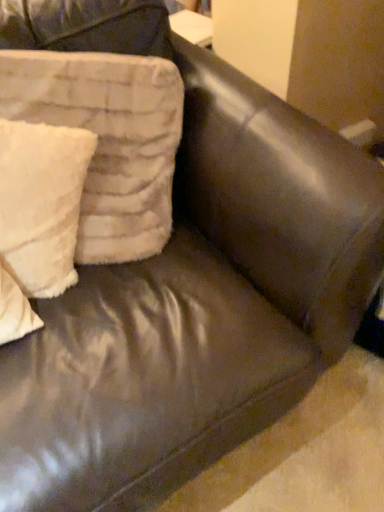
In order to face white fuzzy pillow at left, marked as the first pillow in a right-to-left arrangement, should I rotate leftwards or rightwards?

You should look left and rotate roughly 14.630 degrees.

In order to click on white fuzzy pillow at left, which is the 2th pillow from left to right in this screenshot , I will do `click(108, 140)`.

The image size is (384, 512). What do you see at coordinates (108, 140) in the screenshot?
I see `white fuzzy pillow at left, which is the 2th pillow from left to right` at bounding box center [108, 140].

Locate an element on the screen. Image resolution: width=384 pixels, height=512 pixels. white fluffy pillow at left, placed as the 1th pillow when sorted from left to right is located at coordinates (41, 203).

What do you see at coordinates (41, 203) in the screenshot?
I see `white fluffy pillow at left, placed as the 1th pillow when sorted from left to right` at bounding box center [41, 203].

Identify the location of white fuzzy pillow at left, marked as the first pillow in a right-to-left arrangement. (108, 140).

Would you say white fuzzy pillow at left, which is the 2th pillow from left to right, is to the left or to the right of white fluffy pillow at left, placed as the 1th pillow when sorted from left to right, in the picture?

From the image, it's evident that white fuzzy pillow at left, which is the 2th pillow from left to right, is to the right of white fluffy pillow at left, placed as the 1th pillow when sorted from left to right.

In the image, is white fuzzy pillow at left, which is the 2th pillow from left to right, positioned in front of or behind white fluffy pillow at left, placed as the 1th pillow when sorted from left to right?

Visually, white fuzzy pillow at left, which is the 2th pillow from left to right, is located in front of white fluffy pillow at left, placed as the 1th pillow when sorted from left to right.

Does point (150, 138) lie behind point (11, 273)?

Yes, it is behind point (11, 273).

From the image's perspective, which is above, white fuzzy pillow at left, which is the 2th pillow from left to right, or white fluffy pillow at left, which ranks as the 2th pillow in right-to-left order?

white fuzzy pillow at left, which is the 2th pillow from left to right, appears higher in the image.

From a real-world perspective, is white fuzzy pillow at left, which is the 2th pillow from left to right, under white fluffy pillow at left, which ranks as the 2th pillow in right-to-left order?

Incorrect, from a real-world perspective, white fuzzy pillow at left, which is the 2th pillow from left to right, is higher than white fluffy pillow at left, which ranks as the 2th pillow in right-to-left order.

Which object is thinner, white fuzzy pillow at left, marked as the first pillow in a right-to-left arrangement, or white fluffy pillow at left, which ranks as the 2th pillow in right-to-left order?

white fluffy pillow at left, which ranks as the 2th pillow in right-to-left order.

Is white fuzzy pillow at left, which is the 2th pillow from left to right, taller than white fluffy pillow at left, which ranks as the 2th pillow in right-to-left order?

Indeed, white fuzzy pillow at left, which is the 2th pillow from left to right, has a greater height compared to white fluffy pillow at left, which ranks as the 2th pillow in right-to-left order.

Which of these two, white fuzzy pillow at left, marked as the first pillow in a right-to-left arrangement, or white fluffy pillow at left, placed as the 1th pillow when sorted from left to right, is bigger?

white fuzzy pillow at left, marked as the first pillow in a right-to-left arrangement, is bigger.

Is white fuzzy pillow at left, marked as the first pillow in a right-to-left arrangement, positioned beyond the bounds of white fluffy pillow at left, placed as the 1th pillow when sorted from left to right?

Indeed, white fuzzy pillow at left, marked as the first pillow in a right-to-left arrangement, is completely outside white fluffy pillow at left, placed as the 1th pillow when sorted from left to right.

Is white fuzzy pillow at left, which is the 2th pillow from left to right, next to white fluffy pillow at left, placed as the 1th pillow when sorted from left to right, and touching it?

white fuzzy pillow at left, which is the 2th pillow from left to right, and white fluffy pillow at left, placed as the 1th pillow when sorted from left to right, are clearly separated.

Is white fuzzy pillow at left, marked as the first pillow in a right-to-left arrangement, positioned with its back to white fluffy pillow at left, placed as the 1th pillow when sorted from left to right?

Yes.

The height and width of the screenshot is (512, 384). Find the location of `pillow on the right of white fluffy pillow at left, which ranks as the 2th pillow in right-to-left order`. pillow on the right of white fluffy pillow at left, which ranks as the 2th pillow in right-to-left order is located at coordinates (108, 140).

Does white fluffy pillow at left, which ranks as the 2th pillow in right-to-left order, appear on the right side of white fuzzy pillow at left, marked as the first pillow in a right-to-left arrangement?

No.

Does white fluffy pillow at left, placed as the 1th pillow when sorted from left to right, come behind white fuzzy pillow at left, which is the 2th pillow from left to right?

Yes, it is.

Consider the image. Which is further, (x=29, y=261) or (x=110, y=214)?

The point (x=110, y=214) is more distant.

From the picture: From the image's perspective, which one is positioned higher, white fluffy pillow at left, which ranks as the 2th pillow in right-to-left order, or white fuzzy pillow at left, which is the 2th pillow from left to right?

white fuzzy pillow at left, which is the 2th pillow from left to right, from the image's perspective.

From a real-world perspective, does white fluffy pillow at left, which ranks as the 2th pillow in right-to-left order, stand above white fuzzy pillow at left, which is the 2th pillow from left to right?

Actually, white fluffy pillow at left, which ranks as the 2th pillow in right-to-left order, is physically below white fuzzy pillow at left, which is the 2th pillow from left to right, in the real world.

Is white fluffy pillow at left, which ranks as the 2th pillow in right-to-left order, wider or thinner than white fuzzy pillow at left, which is the 2th pillow from left to right?

In the image, white fluffy pillow at left, which ranks as the 2th pillow in right-to-left order, appears to be more narrow than white fuzzy pillow at left, which is the 2th pillow from left to right.

In terms of height, does white fluffy pillow at left, placed as the 1th pillow when sorted from left to right, look taller or shorter compared to white fuzzy pillow at left, which is the 2th pillow from left to right?

In the image, white fluffy pillow at left, placed as the 1th pillow when sorted from left to right, appears to be shorter than white fuzzy pillow at left, which is the 2th pillow from left to right.

Can you confirm if white fluffy pillow at left, placed as the 1th pillow when sorted from left to right, is smaller than white fuzzy pillow at left, marked as the first pillow in a right-to-left arrangement?

Yes, white fluffy pillow at left, placed as the 1th pillow when sorted from left to right, is smaller than white fuzzy pillow at left, marked as the first pillow in a right-to-left arrangement.

Would you say white fluffy pillow at left, which ranks as the 2th pillow in right-to-left order, is outside white fuzzy pillow at left, marked as the first pillow in a right-to-left arrangement?

No.

In the scene shown: Is white fluffy pillow at left, placed as the 1th pillow when sorted from left to right, in contact with white fuzzy pillow at left, marked as the first pillow in a right-to-left arrangement?

No, white fluffy pillow at left, placed as the 1th pillow when sorted from left to right, is not next to white fuzzy pillow at left, marked as the first pillow in a right-to-left arrangement.

Is white fluffy pillow at left, placed as the 1th pillow when sorted from left to right, oriented towards white fuzzy pillow at left, marked as the first pillow in a right-to-left arrangement?

Yes, white fluffy pillow at left, placed as the 1th pillow when sorted from left to right, is facing white fuzzy pillow at left, marked as the first pillow in a right-to-left arrangement.

Where is `pillow to the right of white fluffy pillow at left, which ranks as the 2th pillow in right-to-left order`? The height and width of the screenshot is (512, 384). pillow to the right of white fluffy pillow at left, which ranks as the 2th pillow in right-to-left order is located at coordinates (108, 140).

Locate an element on the screen. The height and width of the screenshot is (512, 384). pillow located above the white fluffy pillow at left, placed as the 1th pillow when sorted from left to right (from a real-world perspective) is located at coordinates (108, 140).

At what (x,y) coordinates should I click in order to perform the action: click on pillow below the white fuzzy pillow at left, marked as the first pillow in a right-to-left arrangement (from the image's perspective). Please return your answer as a coordinate pair (x, y). The height and width of the screenshot is (512, 384). Looking at the image, I should click on [x=41, y=203].